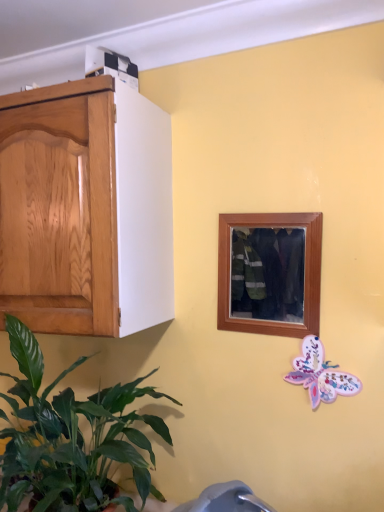
Question: From the image's perspective, is wooden picture frame at center located beneath pastel paper butterfly at lower right?

Choices:
 (A) yes
 (B) no

Answer: (B)

Question: Could you tell me if wooden picture frame at center is turned towards pastel paper butterfly at lower right?

Choices:
 (A) yes
 (B) no

Answer: (B)

Question: Is wooden picture frame at center looking in the opposite direction of pastel paper butterfly at lower right?

Choices:
 (A) yes
 (B) no

Answer: (B)

Question: Is wooden picture frame at center taller than pastel paper butterfly at lower right?

Choices:
 (A) yes
 (B) no

Answer: (A)

Question: Can you confirm if wooden picture frame at center is shorter than pastel paper butterfly at lower right?

Choices:
 (A) no
 (B) yes

Answer: (A)

Question: Is wooden picture frame at center to the left or to the right of pastel paper butterfly at lower right in the image?

Choices:
 (A) left
 (B) right

Answer: (A)

Question: Is wooden picture frame at center wider or thinner than pastel paper butterfly at lower right?

Choices:
 (A) thin
 (B) wide

Answer: (B)

Question: Is wooden picture frame at center bigger or smaller than pastel paper butterfly at lower right?

Choices:
 (A) small
 (B) big

Answer: (B)

Question: Is point (297, 300) positioned closer to the camera than point (297, 356)?

Choices:
 (A) closer
 (B) farther

Answer: (A)

Question: Does point (322, 377) appear closer or farther from the camera than point (284, 282)?

Choices:
 (A) closer
 (B) farther

Answer: (A)

Question: Looking at their shapes, would you say pastel paper butterfly at lower right is wider or thinner than wooden picture frame at center?

Choices:
 (A) thin
 (B) wide

Answer: (A)

Question: Based on their positions, is pastel paper butterfly at lower right located to the left or right of wooden picture frame at center?

Choices:
 (A) right
 (B) left

Answer: (A)

Question: Looking at the image, does pastel paper butterfly at lower right seem bigger or smaller compared to wooden picture frame at center?

Choices:
 (A) big
 (B) small

Answer: (B)

Question: Considering the positions of point (309, 307) and point (139, 415), is point (309, 307) closer or farther from the camera than point (139, 415)?

Choices:
 (A) farther
 (B) closer

Answer: (B)

Question: From the image's perspective, is wooden picture frame at center located above or below green leafy plant at lower left?

Choices:
 (A) above
 (B) below

Answer: (A)